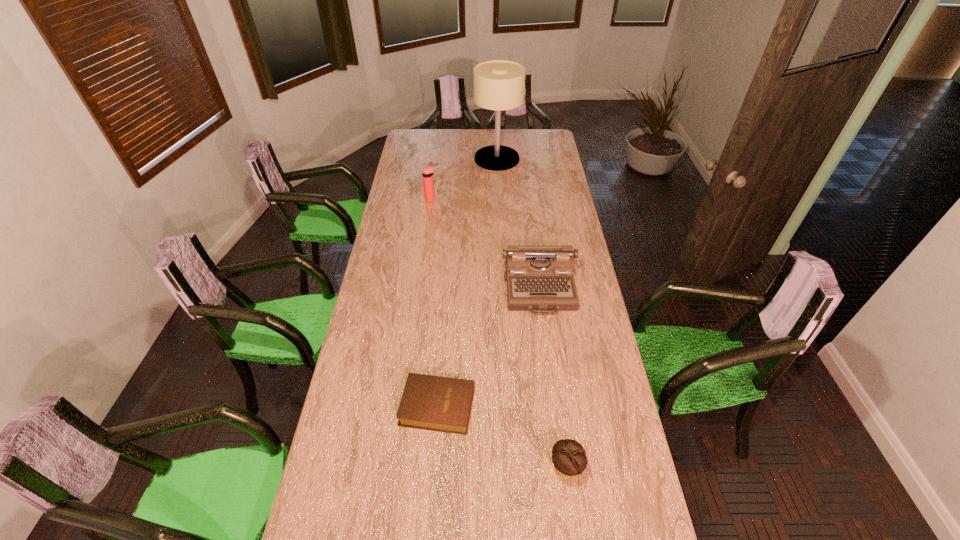
The image size is (960, 540). I want to click on the tallest object, so click(x=499, y=85).

You are a GUI agent. You are given a task and a screenshot of the screen. Output one action in this format:
    pyautogui.click(x=<x>, y=<y>)
    Task: Click on the table lamp
    Image resolution: width=960 pixels, height=540 pixels.
    Given the screenshot: What is the action you would take?
    pyautogui.click(x=499, y=85)

Identify the location of the second tallest object. (428, 171).

Identify the location of thermos bottle. Image resolution: width=960 pixels, height=540 pixels. (428, 171).

Identify the location of the third shortest object. The image size is (960, 540). (539, 278).

The image size is (960, 540). Identify the location of the third farthest object. (539, 278).

Where is `muffin`? The image size is (960, 540). muffin is located at coordinates (569, 457).

The width and height of the screenshot is (960, 540). What are the coordinates of `the nearest object` in the screenshot? It's located at (569, 457).

The image size is (960, 540). Identify the location of the shortest object. (443, 404).

This screenshot has width=960, height=540. What are the coordinates of `the fourth farthest object` in the screenshot? It's located at (443, 404).